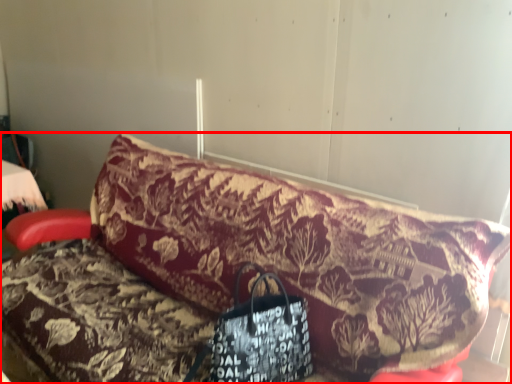
Question: Observing the image, what is the correct spatial positioning of furniture (annotated by the red box) in reference to handbag?

Choices:
 (A) left
 (B) right

Answer: (A)